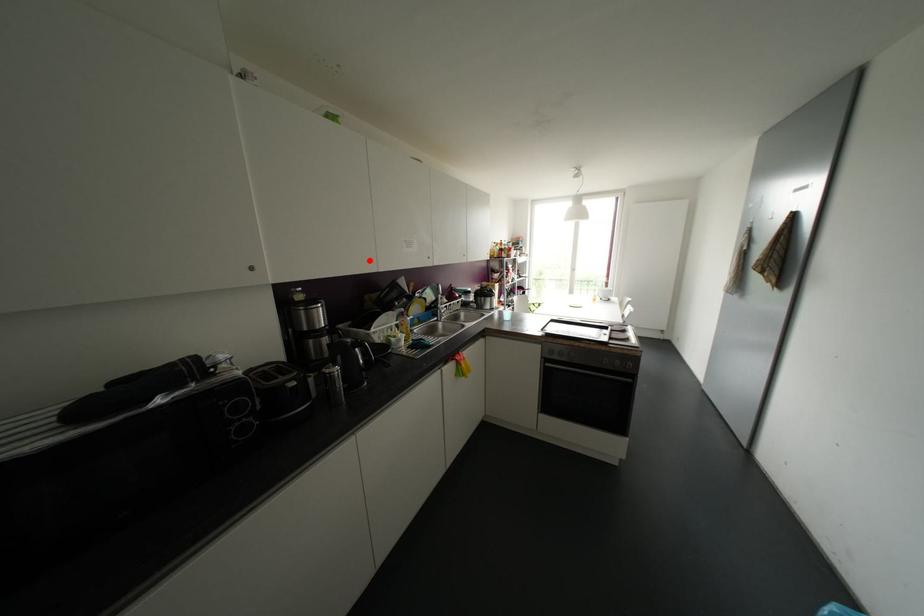
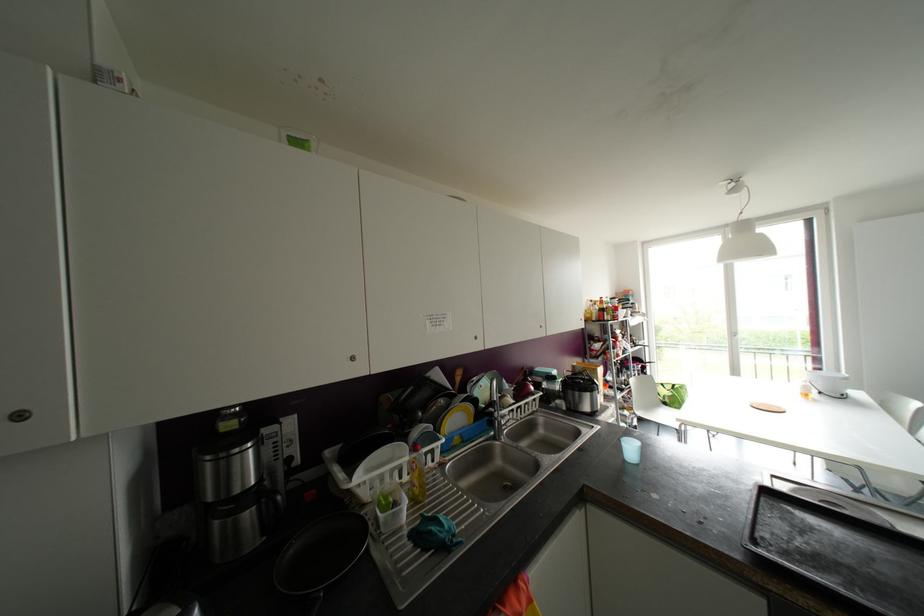
The point at the highlighted location is marked in the first image. Where is the corresponding point in the second image?

(351, 358)